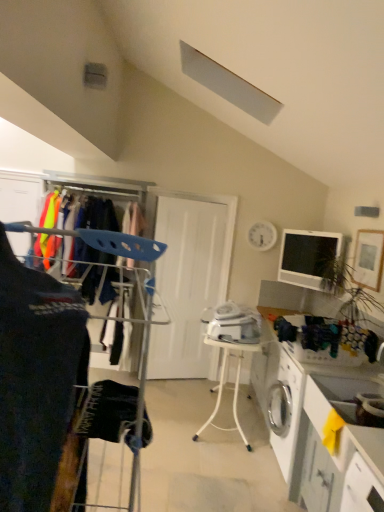
Image resolution: width=384 pixels, height=512 pixels. I want to click on vacant space in front of white plastic table at center, so click(219, 468).